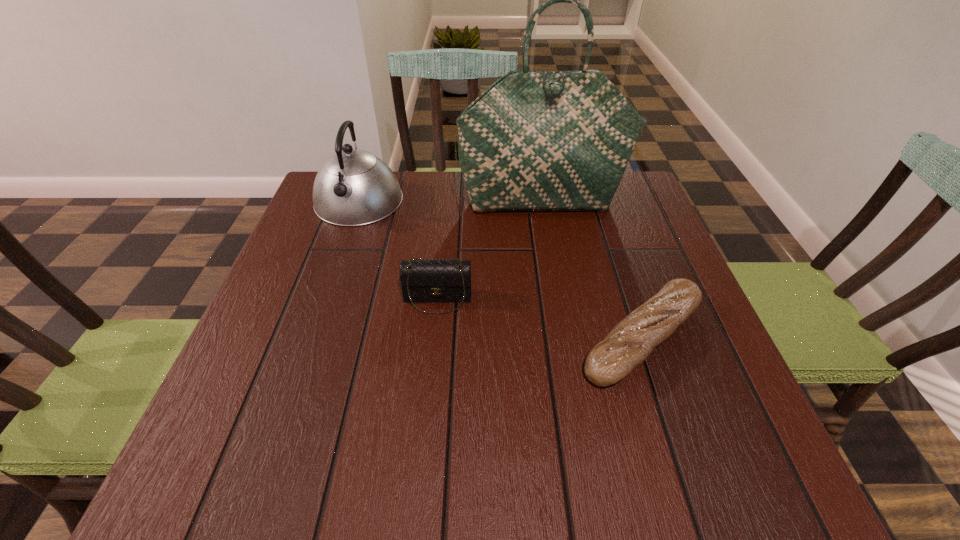
Locate an element on the screen. This screenshot has width=960, height=540. free space at the far right corner is located at coordinates (610, 218).

You are a GUI agent. You are given a task and a screenshot of the screen. Output one action in this format:
    pyautogui.click(x=<x>, y=<y>)
    Task: Click on the vacant space at the near right corner of the desktop
    
    Given the screenshot: What is the action you would take?
    pyautogui.click(x=750, y=460)

Find the location of a particular element. The height and width of the screenshot is (540, 960). blank region between the tallest object and the leftmost object is located at coordinates (450, 202).

Locate an element on the screen. This screenshot has height=540, width=960. free space between the second shortest object and the leftmost object is located at coordinates (398, 250).

At what (x,y) coordinates should I click in order to perform the action: click on free space between the third tallest object and the baguet. Please return your answer as a coordinate pair (x, y). Looking at the image, I should click on (540, 319).

At what (x,y) coordinates should I click in order to perform the action: click on vacant area that lies between the third tallest object and the kettle. Please return your answer as a coordinate pair (x, y). Looking at the image, I should click on [x=398, y=250].

Image resolution: width=960 pixels, height=540 pixels. Identify the location of blank region between the third shortest object and the second shortest object. (398, 250).

You are a GUI agent. You are given a task and a screenshot of the screen. Output one action in this format:
    pyautogui.click(x=<x>, y=<y>)
    Task: Click on the free space between the second shortest object and the tallest object
    
    Given the screenshot: What is the action you would take?
    pyautogui.click(x=490, y=251)

Locate an element on the screen. The height and width of the screenshot is (540, 960). unoccupied position between the tote bag and the clutch bag is located at coordinates (490, 251).

I want to click on free space between the clutch bag and the tote bag, so click(490, 251).